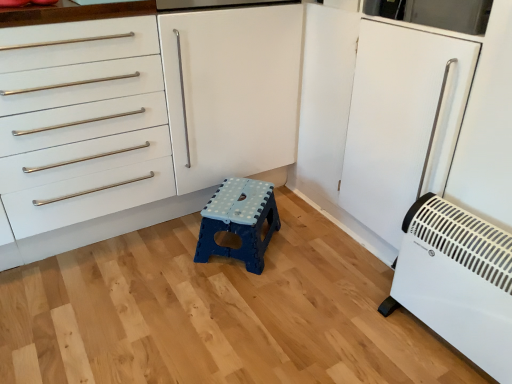
What do you see at coordinates (239, 221) in the screenshot? I see `blue plastic stool at center` at bounding box center [239, 221].

At what (x,y) coordinates should I click in order to perform the action: click on blue plastic stool at center. Please return your answer as a coordinate pair (x, y). Looking at the image, I should click on (239, 221).

Between white plastic heater at lower right and white matte cabinet at center, which one has smaller size?

white plastic heater at lower right.

From a real-world perspective, who is located higher, white plastic heater at lower right or white matte cabinet at center?

white matte cabinet at center, from a real-world perspective.

How many degrees apart are the facing directions of white plastic heater at lower right and white matte cabinet at center?

There is a 91.7-degree angle between the facing directions of white plastic heater at lower right and white matte cabinet at center.

You are a GUI agent. You are given a task and a screenshot of the screen. Output one action in this format:
    pyautogui.click(x=<x>, y=<y>)
    Task: Click on the cabinetry behind the white plastic heater at lower right
    Image resolution: width=512 pixels, height=384 pixels.
    Given the screenshot: What is the action you would take?
    pyautogui.click(x=231, y=91)

Who is bigger, blue plastic stool at center or white matte cabinet at center?

Bigger between the two is white matte cabinet at center.

Is blue plastic stool at center turned away from white matte cabinet at center?

Absolutely, blue plastic stool at center is directed away from white matte cabinet at center.

Considering the sizes of objects blue plastic stool at center and white matte cabinet at center in the image provided, who is wider, blue plastic stool at center or white matte cabinet at center?

white matte cabinet at center is wider.

From the image's perspective, is blue plastic stool at center beneath white matte cabinet at center?

Yes.

From the picture: Is blue plastic stool at center further to camera compared to white plastic heater at lower right?

Yes, blue plastic stool at center is further from the camera.

Is blue plastic stool at center oriented towards white plastic heater at lower right?

No, blue plastic stool at center is not turned towards white plastic heater at lower right.

Is blue plastic stool at center wider than white plastic heater at lower right?

Indeed, blue plastic stool at center has a greater width compared to white plastic heater at lower right.

Is blue plastic stool at center completely or partially outside of white plastic heater at lower right?

Yes, blue plastic stool at center is not within white plastic heater at lower right.

Which of these two, white plastic heater at lower right or blue plastic stool at center, is smaller?

With smaller size is blue plastic stool at center.

Can you confirm if white plastic heater at lower right is shorter than blue plastic stool at center?

No, white plastic heater at lower right is not shorter than blue plastic stool at center.

Which is nearer, [479,357] or [260,189]?

Point [479,357] is positioned closer to the camera compared to point [260,189].

How many degrees apart are the facing directions of white plastic heater at lower right and blue plastic stool at center?

41.4 degrees separate the facing orientations of white plastic heater at lower right and blue plastic stool at center.

Considering the relative sizes of white matte cabinet at center and white plastic heater at lower right in the image provided, is white matte cabinet at center wider than white plastic heater at lower right?

Indeed, white matte cabinet at center has a greater width compared to white plastic heater at lower right.

Considering the relative sizes of white matte cabinet at center and white plastic heater at lower right in the image provided, is white matte cabinet at center taller than white plastic heater at lower right?

Indeed, white matte cabinet at center has a greater height compared to white plastic heater at lower right.

Can you tell me how much white matte cabinet at center and white plastic heater at lower right differ in facing direction?

They differ by 91.7 degrees in their facing directions.

Which is behind, point (249, 173) or point (486, 268)?

Positioned behind is point (249, 173).

Which object is thinner, white matte cabinet at center or blue plastic stool at center?

blue plastic stool at center.

Can you tell me how much white matte cabinet at center and blue plastic stool at center differ in facing direction?

50.4 degrees separate the facing orientations of white matte cabinet at center and blue plastic stool at center.

Locate an element on the screen. furniture that is behind the white matte cabinet at center is located at coordinates (239, 221).

Looking at this image, from the image's perspective, who appears lower, white matte cabinet at center or blue plastic stool at center?

blue plastic stool at center, from the image's perspective.

At what (x,y) coordinates should I click in order to perform the action: click on cabinetry lying on the left of white plastic heater at lower right. Please return your answer as a coordinate pair (x, y). The image size is (512, 384). Looking at the image, I should click on (231, 91).

Identify the location of cabinetry above the blue plastic stool at center (from a real-world perspective). (231, 91).

Estimate the real-world distances between objects in this image. Which object is closer to blue plastic stool at center, white matte cabinet at center or white plastic heater at lower right?

white matte cabinet at center lies closer to blue plastic stool at center than the other object.

Looking at the image, which one is located closer to white plastic heater at lower right, blue plastic stool at center or white matte cabinet at center?

blue plastic stool at center is closer to white plastic heater at lower right.

Which object lies further to the anchor point white matte cabinet at center, white plastic heater at lower right or blue plastic stool at center?

white plastic heater at lower right is further to white matte cabinet at center.

Based on their spatial positions, is white matte cabinet at center or blue plastic stool at center closer to white plastic heater at lower right?

The object closer to white plastic heater at lower right is blue plastic stool at center.

Based on their spatial positions, is white plastic heater at lower right or white matte cabinet at center closer to blue plastic stool at center?

white matte cabinet at center lies closer to blue plastic stool at center than the other object.

Looking at the image, which one is located closer to white matte cabinet at center, blue plastic stool at center or white plastic heater at lower right?

The object closer to white matte cabinet at center is blue plastic stool at center.

You are a GUI agent. You are given a task and a screenshot of the screen. Output one action in this format:
    pyautogui.click(x=<x>, y=<y>)
    Task: Click on the furniture between white matte cabinet at center and white plastic heater at lower right in the horizontal direction
    The width and height of the screenshot is (512, 384).
    Given the screenshot: What is the action you would take?
    pyautogui.click(x=239, y=221)